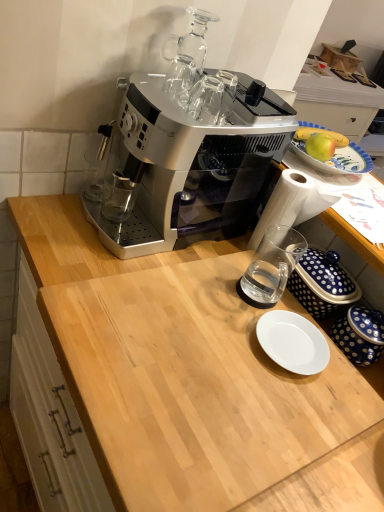
Locate an element on the screen. unoccupied area in front of white glossy plate at center is located at coordinates (274, 414).